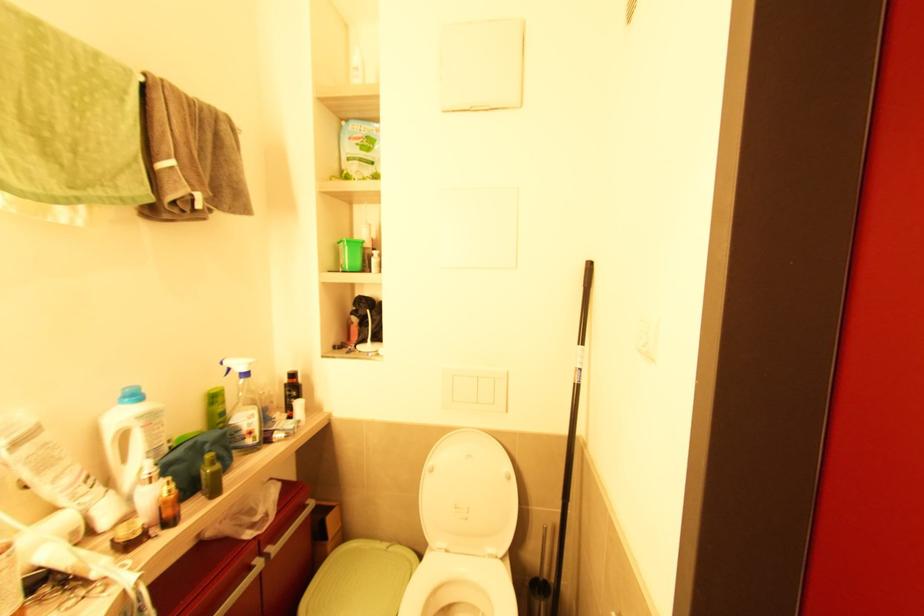
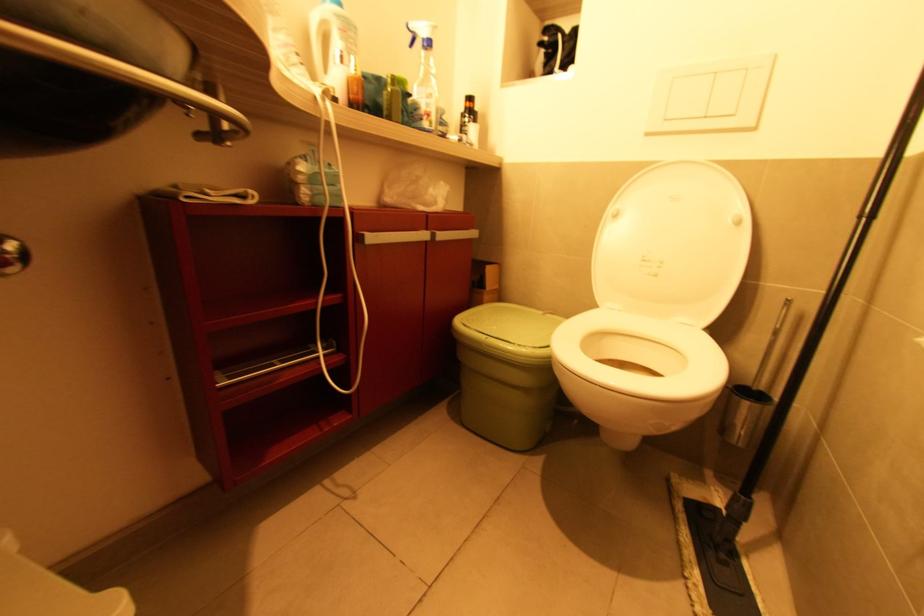
Find the pixel in the second image that matches pixel 247 440 in the first image.

(424, 121)